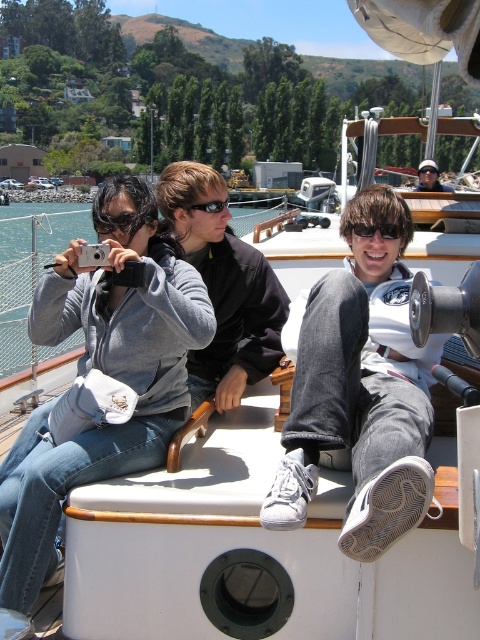
Question: Which object is the closest to the black rubber sunglasses at center?

Choices:
 (A) matte black sunglasses at upper right
 (B) dark brown leather jacket at center
 (C) black plastic sunglasses at center

Answer: (B)

Question: Which object is farther from the camera taking this photo?

Choices:
 (A) matte black sunglasses at upper right
 (B) dark brown leather jacket at center
 (C) black rubber sunglasses at center

Answer: (A)

Question: In this image, where is dark brown leather jacket at center located relative to black plastic sunglasses at center?

Choices:
 (A) above
 (B) below

Answer: (B)

Question: Does dark brown leather jacket at center appear over black rubber sunglasses at center?

Choices:
 (A) yes
 (B) no

Answer: (B)

Question: Which point is farther to the camera?

Choices:
 (A) black plastic sunglasses at center
 (B) matte black sunglasses at upper right
 (C) black rubber sunglasses at center

Answer: (B)

Question: Can you confirm if black plastic sunglasses at center is positioned below black rubber sunglasses at center?

Choices:
 (A) yes
 (B) no

Answer: (A)